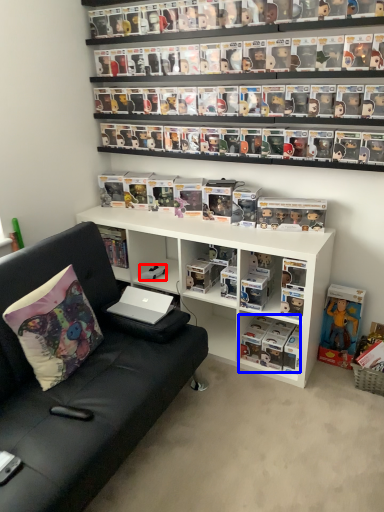
Question: Which object is closer to the camera taking this photo, toy (highlighted by a red box) or book (highlighted by a blue box)?

Choices:
 (A) toy
 (B) book

Answer: (B)